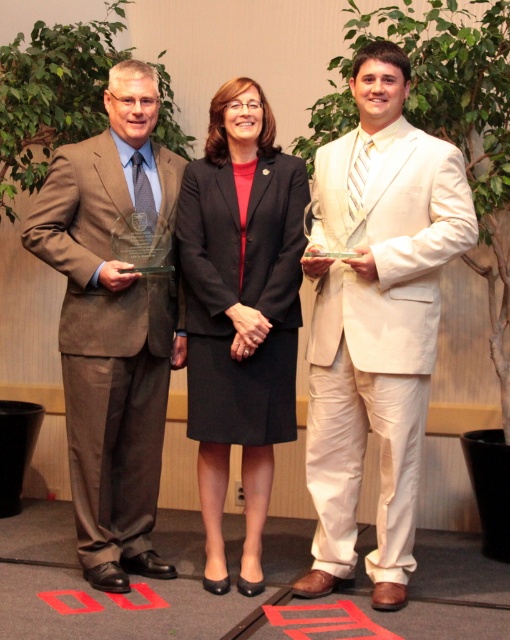
You are an event photographer at the awards ceremony. You need to adjust the height of the podium so that the white satin suit at center and matte brown suit at left are at eye level for the photo. Which individual requires a taller podium adjustment?

The white satin suit at center requires a taller podium adjustment because it has a greater height compared to the matte brown suit at left.

You are a photographer at the event and need to adjust the camera focus to ensure both the white satin suit at center and the black fabric skirt at center are in focus. Given that the depth of field can only accommodate one of them clearly, which one should you prioritize focusing on based on their positions?

The white satin suit at center has a greater height compared to the black fabric skirt at center, so you should prioritize focusing on the white satin suit at center to ensure it is in focus.